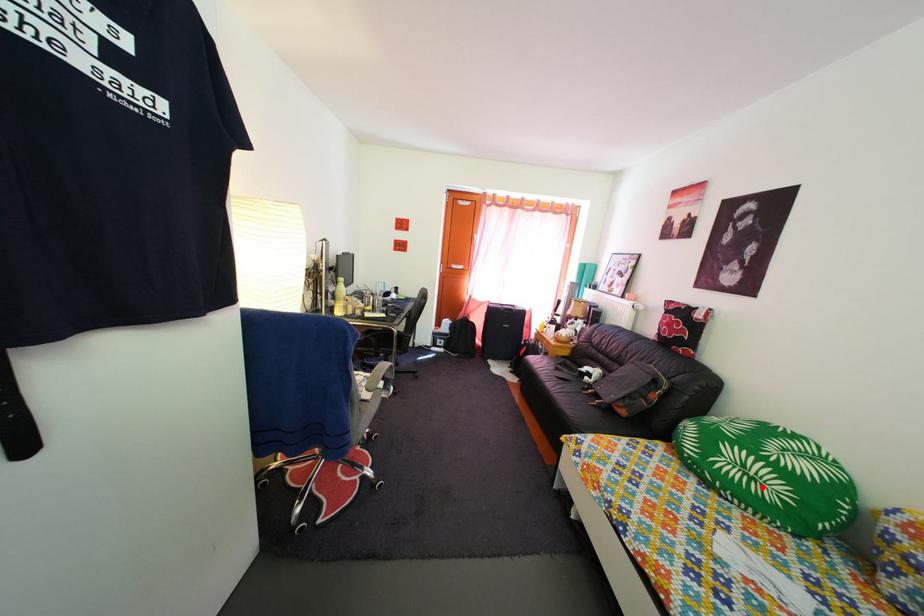
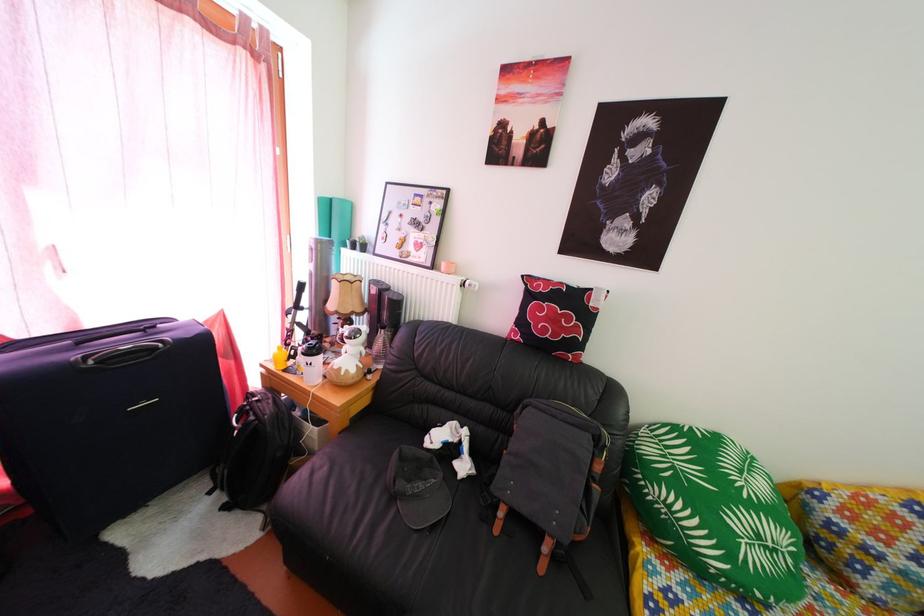
Question: A red point is marked in image1. In image2, is the corresponding 3D point closer to the camera or farther? Reply with the corresponding letter.

Choices:
 (A) The corresponding 3D point is closer.
 (B) The corresponding 3D point is farther.

Answer: (A)